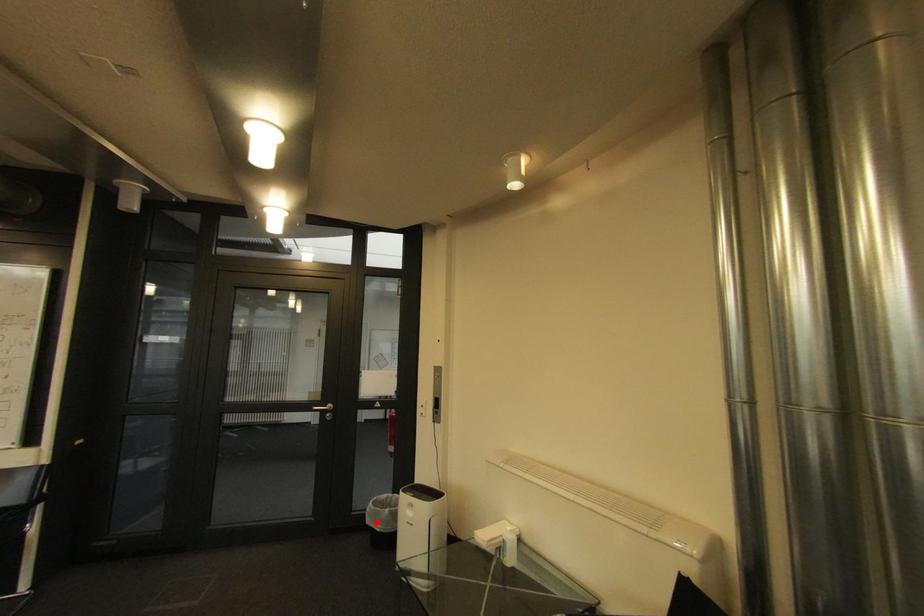
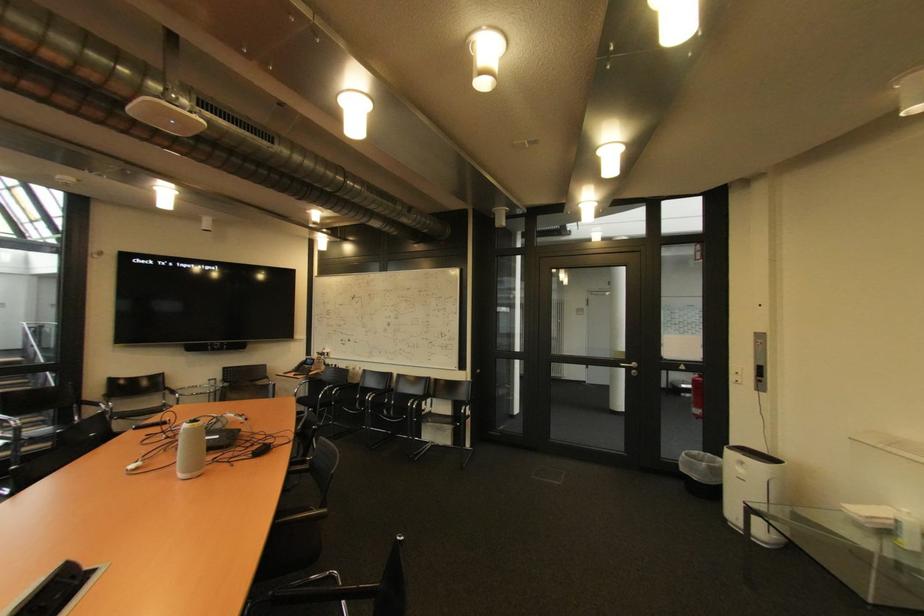
Find the pixel in the second image that matches the highlighted location in the first image.

(690, 471)